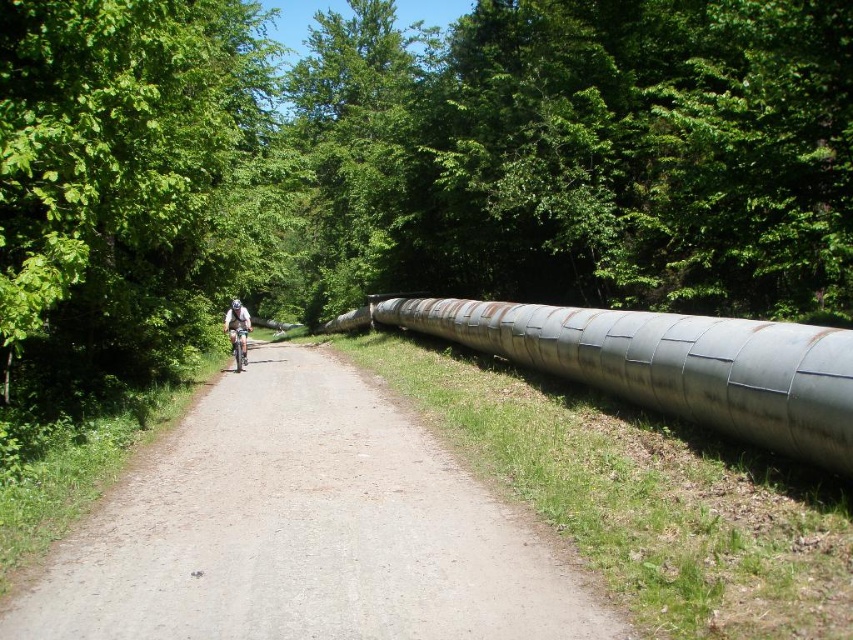
Is gray gravel path at center shorter than silver metallic bicycle at center?

Correct, gray gravel path at center is not as tall as silver metallic bicycle at center.

Does gray gravel path at center have a smaller size compared to silver metallic bicycle at center?

No, gray gravel path at center is not smaller than silver metallic bicycle at center.

From the picture: Who is more distant from viewer, (476, 481) or (231, 346)?

Point (231, 346)

The width and height of the screenshot is (853, 640). Find the location of `gray gravel path at center`. gray gravel path at center is located at coordinates (303, 531).

Is gray gravel path at center wider than white matte bicycle helmet at center?

Yes.

Is gray gravel path at center further to camera compared to white matte bicycle helmet at center?

That is False.

The width and height of the screenshot is (853, 640). What are the coordinates of `gray gravel path at center` in the screenshot? It's located at (303, 531).

Is gray gravel path at center further to the viewer compared to light blue fabric helmet at center?

No.

Is the position of gray gravel path at center less distant than that of light blue fabric helmet at center?

Yes, it is.

Which is behind, point (380, 477) or point (223, 323)?

Point (223, 323)

I want to click on gray gravel path at center, so click(303, 531).